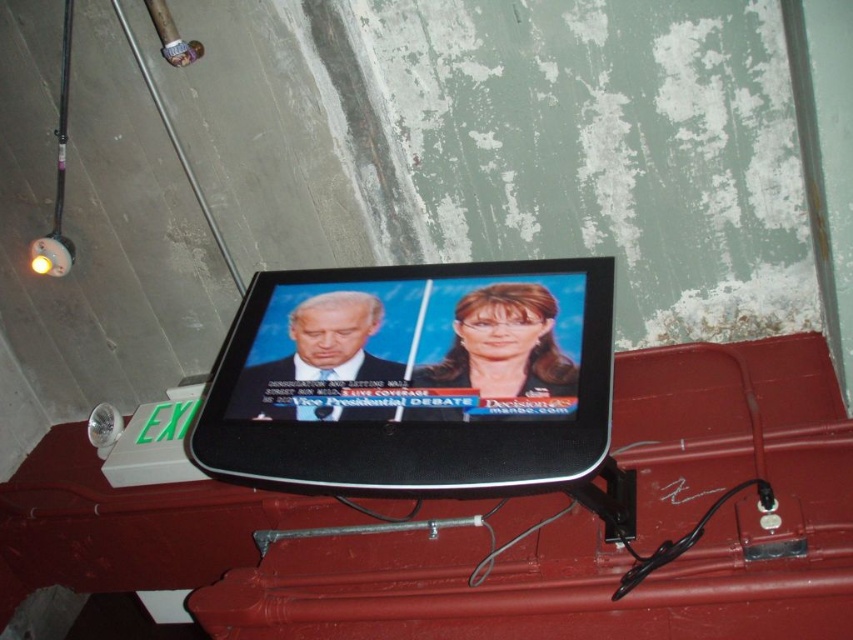
Question: Considering the relative positions of black glossy screen at center and matte black lamp at upper left in the image provided, where is black glossy screen at center located with respect to matte black lamp at upper left?

Choices:
 (A) left
 (B) right

Answer: (B)

Question: In this image, where is black glossy screen at center located relative to matte black lamp at upper left?

Choices:
 (A) above
 (B) below

Answer: (B)

Question: Which point is farther to the camera?

Choices:
 (A) (61, 228)
 (B) (540, 340)

Answer: (A)

Question: Which object is closer to the camera taking this photo?

Choices:
 (A) matte black lamp at upper left
 (B) black glossy screen at center

Answer: (B)

Question: Does black glossy screen at center lie in front of matte black lamp at upper left?

Choices:
 (A) yes
 (B) no

Answer: (A)